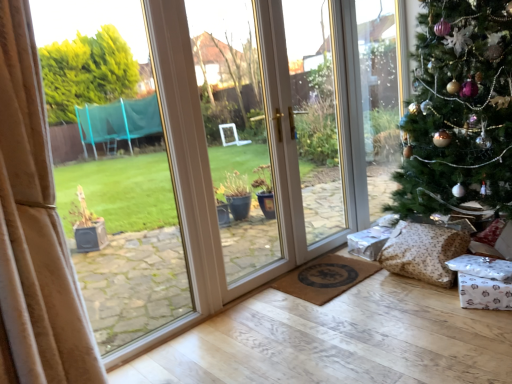
Question: Do you think brown textured doormat at lower center is within green textured christmas tree at right, or outside of it?

Choices:
 (A) outside
 (B) inside

Answer: (A)

Question: From a real-world perspective, is brown textured doormat at lower center physically located above or below green textured christmas tree at right?

Choices:
 (A) above
 (B) below

Answer: (B)

Question: Based on their relative distances, which object is nearer to the green textured christmas tree at right?

Choices:
 (A) brown textured doormat at lower center
 (B) brown textured pillow at lower right

Answer: (B)

Question: Which object is positioned closest to the green textured christmas tree at right?

Choices:
 (A) brown textured doormat at lower center
 (B) brown textured pillow at lower right

Answer: (B)